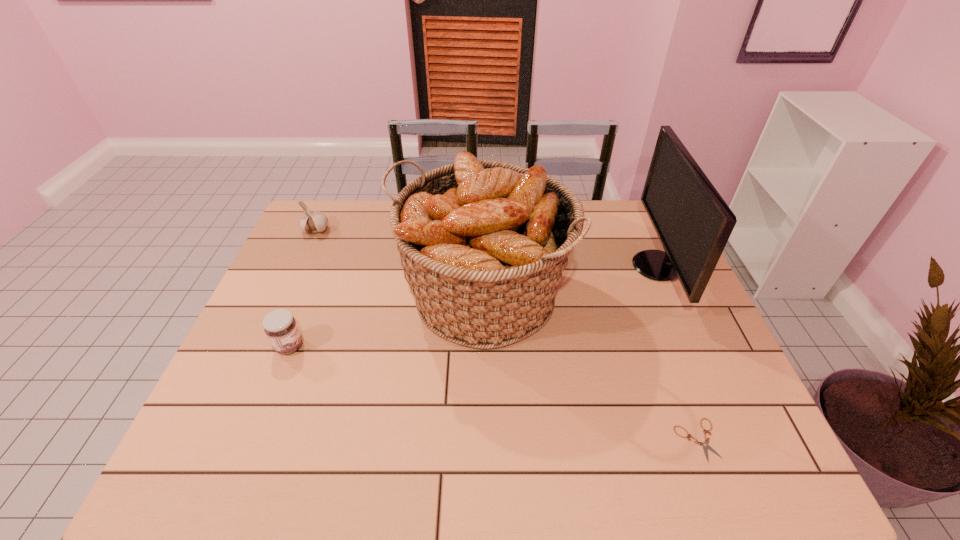
Find the location of a particular element. This screenshot has width=960, height=540. free space between the shears and the jam is located at coordinates (493, 393).

I want to click on vacant space that is in between the shortest object and the computer monitor, so click(x=677, y=353).

Where is `object that is the third nearest to the jam`? object that is the third nearest to the jam is located at coordinates (705, 445).

In order to click on object that stands as the fourth closest to the basket in this screenshot , I will do `click(312, 222)`.

Where is `vacant space that satisfies the following two spatial constraints: 1. on the front side of the shortest object; 2. on the left side of the garlic`? Image resolution: width=960 pixels, height=540 pixels. vacant space that satisfies the following two spatial constraints: 1. on the front side of the shortest object; 2. on the left side of the garlic is located at coordinates 222,440.

Identify the location of free space that satisfies the following two spatial constraints: 1. on the front label of the jam; 2. on the back side of the shortest object. (252, 440).

Locate an element on the screen. free location that satisfies the following two spatial constraints: 1. on the back side of the nearest object; 2. on the front label of the jam is located at coordinates (662, 346).

Where is `free point that satisfies the following two spatial constraints: 1. on the front side of the garlic; 2. on the right side of the basket`? Image resolution: width=960 pixels, height=540 pixels. free point that satisfies the following two spatial constraints: 1. on the front side of the garlic; 2. on the right side of the basket is located at coordinates (286, 298).